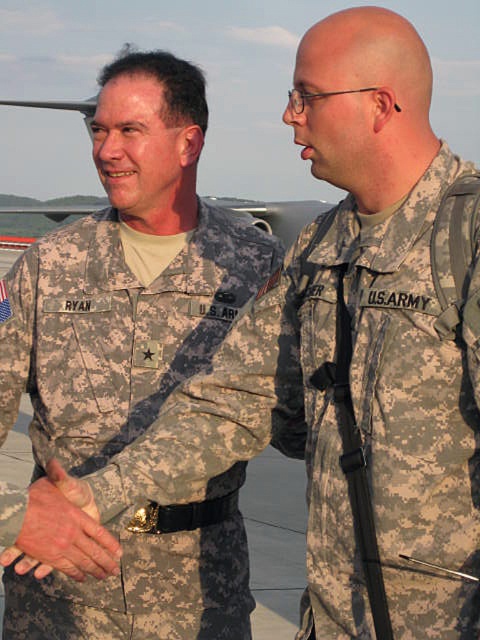
Does point (59, 296) come closer to viewer compared to point (34, 550)?

No, it is behind (34, 550).

Is camouflage fabric uniform at center positioned behind leather glove at center?

Yes, camouflage fabric uniform at center is further from the viewer.

At what (x,y) coordinates should I click in order to perform the action: click on camouflage fabric uniform at center. Please return your answer as a coordinate pair (x, y). Looking at the image, I should click on (117, 328).

Does camouflage fabric us army uniform at right have a larger size compared to leather glove at center?

Yes, camouflage fabric us army uniform at right is bigger than leather glove at center.

Which is above, camouflage fabric us army uniform at right or leather glove at center?

camouflage fabric us army uniform at right is above.

The image size is (480, 640). What do you see at coordinates (386, 412) in the screenshot?
I see `camouflage fabric us army uniform at right` at bounding box center [386, 412].

The image size is (480, 640). Identify the location of camouflage fabric us army uniform at right. (386, 412).

Which is above, camouflage fabric us army uniform at right or camouflage fabric uniform at center?

camouflage fabric uniform at center

Which is behind, point (352, 240) or point (80, 307)?

The point (80, 307) is more distant.

Which is behind, point (418, 442) or point (12, 336)?

The point (12, 336) is behind.

This screenshot has height=640, width=480. I want to click on camouflage fabric us army uniform at right, so click(386, 412).